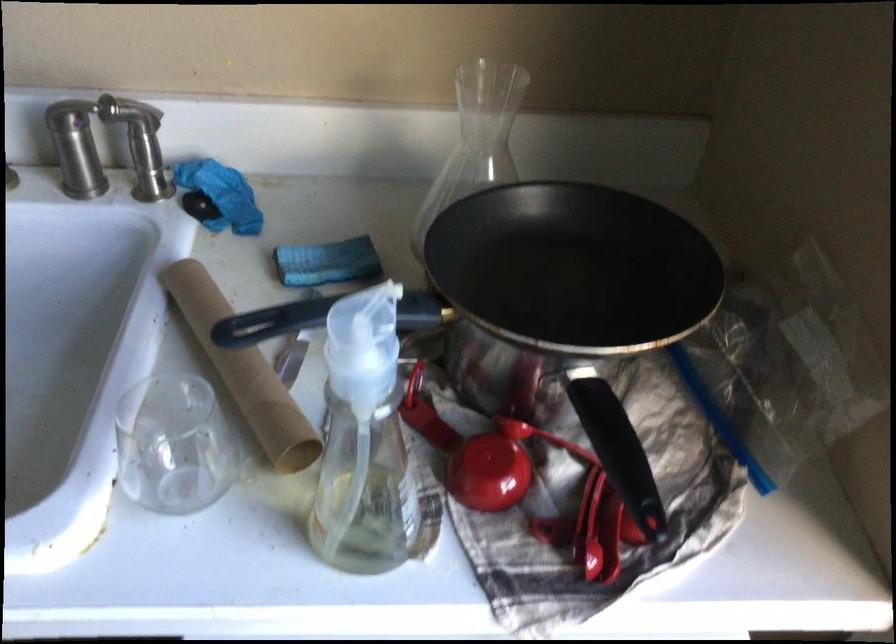
Where would you grasp the small glass cup? Please return your answer as a coordinate pair (x, y).

(174, 444)